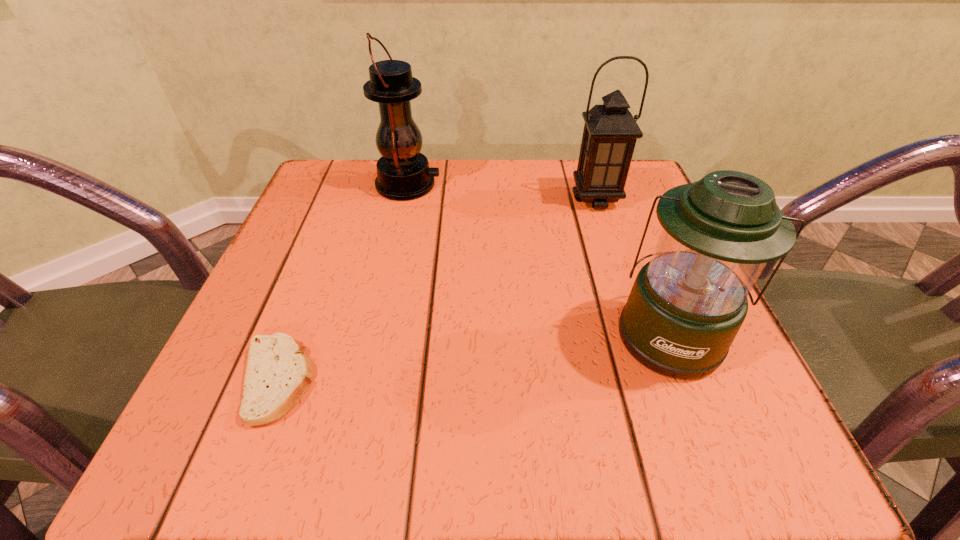
Locate an element on the screen. Image resolution: width=960 pixels, height=540 pixels. object at the far left corner is located at coordinates (403, 173).

Where is `object present at the near left corner`? object present at the near left corner is located at coordinates (277, 373).

Locate an element on the screen. This screenshot has height=540, width=960. object located at the far right corner is located at coordinates (610, 132).

At what (x,y) coordinates should I click in order to perform the action: click on vacant space at the far edge. Please return your answer as a coordinate pair (x, y). This screenshot has height=540, width=960. Looking at the image, I should click on [x=423, y=207].

This screenshot has height=540, width=960. I want to click on vacant space at the near edge of the desktop, so click(459, 444).

Where is `vacant space at the left edge`? vacant space at the left edge is located at coordinates (259, 333).

Image resolution: width=960 pixels, height=540 pixels. Identify the location of vacant region at the right edge of the desktop. (640, 386).

Where is `free space between the nearest lantern and the leftmost object`? free space between the nearest lantern and the leftmost object is located at coordinates (473, 357).

You are a GUI agent. You are given a task and a screenshot of the screen. Output one action in this format:
    pyautogui.click(x=<x>, y=<y>)
    Task: Click on the free spot between the shortest object and the leftmost lantern
    Image resolution: width=960 pixels, height=540 pixels.
    Given the screenshot: What is the action you would take?
    pyautogui.click(x=343, y=282)

Identify the location of empty space that is in between the pita bread and the nearest lantern. (473, 357).